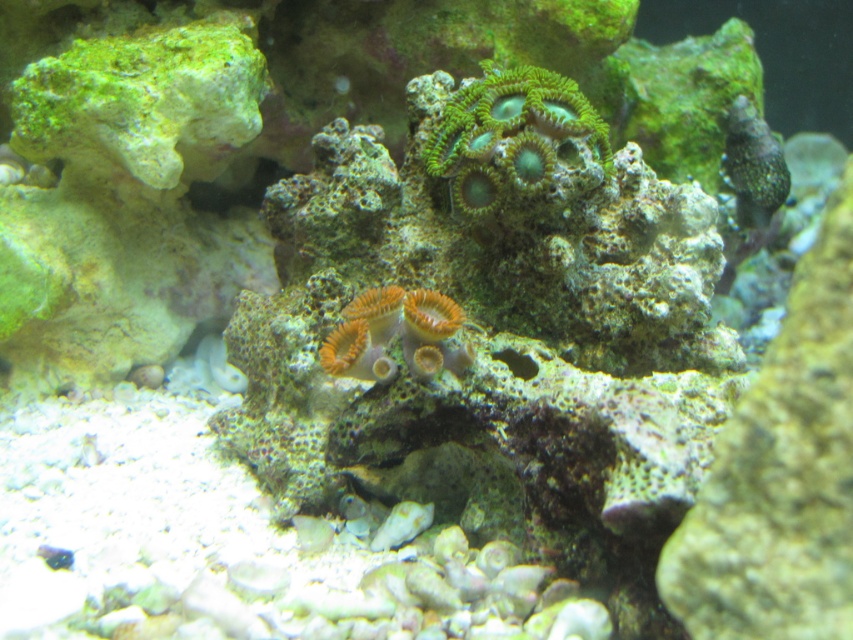
Question: Is green coral at upper center positioned at the back of orange soft coral at center?

Choices:
 (A) yes
 (B) no

Answer: (A)

Question: Which of the following is the closest to the observer?

Choices:
 (A) (508, 92)
 (B) (368, 349)

Answer: (B)

Question: Which object is farther from the camera taking this photo?

Choices:
 (A) orange soft coral at center
 (B) green coral at upper center

Answer: (B)

Question: Considering the relative positions of green coral at upper center and orange soft coral at center in the image provided, where is green coral at upper center located with respect to orange soft coral at center?

Choices:
 (A) left
 (B) right

Answer: (B)

Question: Is green coral at upper center wider than orange soft coral at center?

Choices:
 (A) yes
 (B) no

Answer: (A)

Question: Which point is farther to the camera?

Choices:
 (A) orange soft coral at center
 (B) green coral at upper center

Answer: (B)